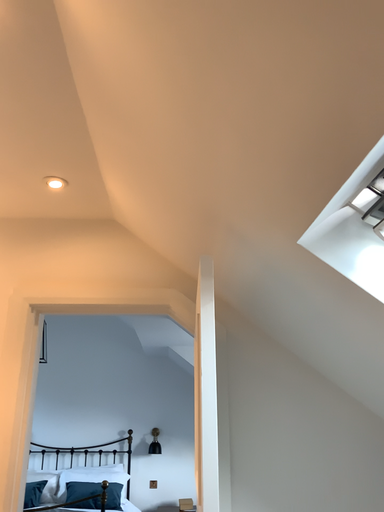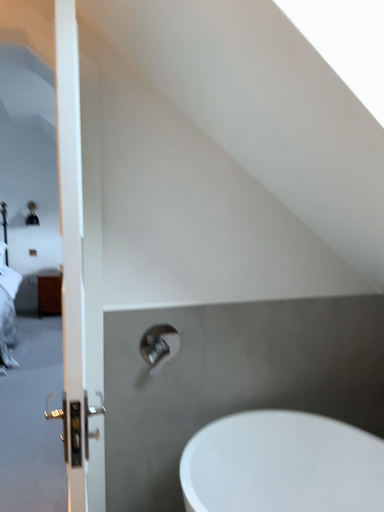
Question: How did the camera likely rotate when shooting the video?

Choices:
 (A) rotated left
 (B) rotated right

Answer: (B)